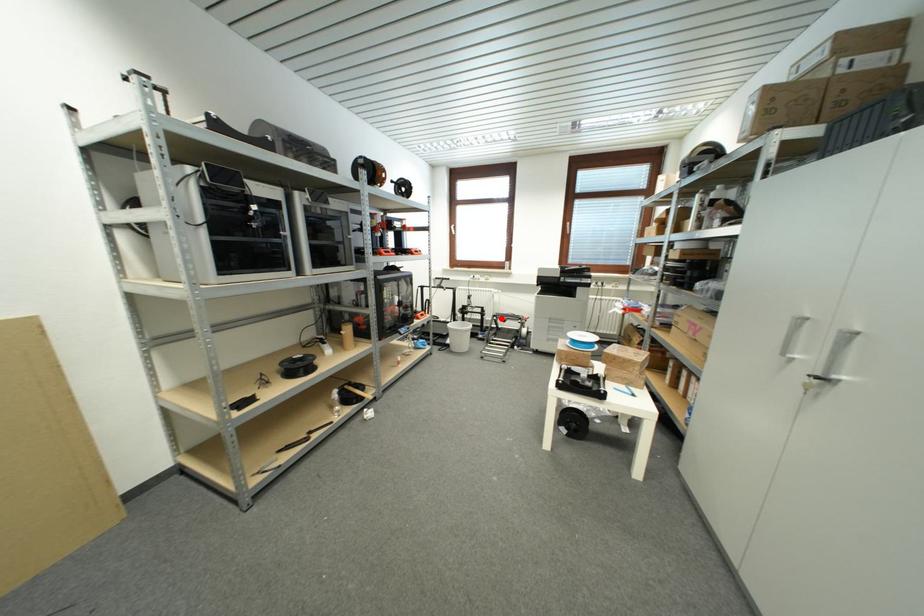
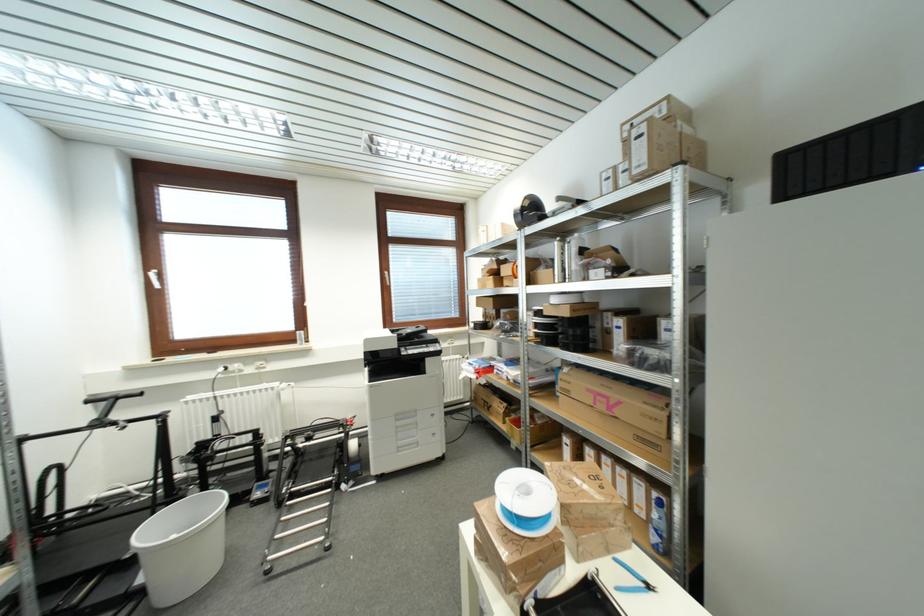
The point at the highlighted location is marked in the first image. Where is the corresponding point in the second image?

(297, 438)